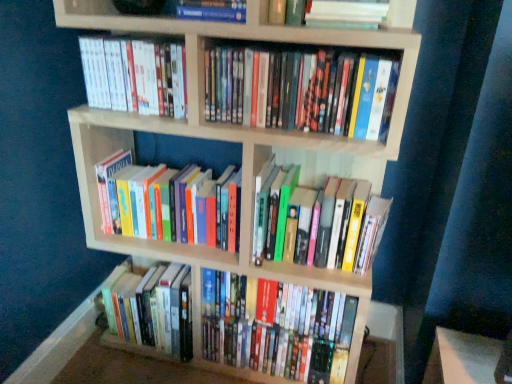
What is the approximate width of hardcover books at center, which appears as the 6th book when viewed from the top?

It is 9.18 inches.

The width and height of the screenshot is (512, 384). Describe the element at coordinates (338, 212) in the screenshot. I see `hardcover books at center, marked as the third book in a bottom-to-top arrangement` at that location.

The image size is (512, 384). What are the coordinates of `hardcover book at center, the eighth book from the top` in the screenshot? It's located at (279, 334).

The image size is (512, 384). In order to click on white matte book at upper center, the 7th book from the bottom in this screenshot , I will do `click(333, 14)`.

Can you confirm if hardcover books at center, which is counted as the 4th book, starting from the bottom, is thinner than hardcover book at center, which ranks as the first book in bottom-to-top order?

Yes, hardcover books at center, which is counted as the 4th book, starting from the bottom, is thinner than hardcover book at center, which ranks as the first book in bottom-to-top order.

Does hardcover books at center, acting as the 5th book starting from the top, appear on the left side of hardcover book at center, the eighth book from the top?

Indeed, hardcover books at center, acting as the 5th book starting from the top, is positioned on the left side of hardcover book at center, the eighth book from the top.

Is hardcover books at center, which is counted as the 4th book, starting from the bottom, positioned far away from hardcover book at center, which ranks as the first book in bottom-to-top order?

They are positioned close to each other.

From their relative heights in the image, would you say hardcover books at center, which is counted as the 4th book, starting from the bottom, is taller or shorter than hardcover book at center, the eighth book from the top?

Considering their sizes, hardcover books at center, which is counted as the 4th book, starting from the bottom, has less height than hardcover book at center, the eighth book from the top.

From the image's perspective, is wooden bookcase at center located above hardcover books at lower left, which is the second book from bottom to top?

Indeed, from the image's perspective, wooden bookcase at center is shown above hardcover books at lower left, which is the second book from bottom to top.

Which is closer to the camera, [273,140] or [144,332]?

Clearly, point [273,140] is closer to the camera than point [144,332].

How different are the orientations of wooden bookcase at center and hardcover books at lower left, which is the second book from bottom to top, in degrees?

They differ by 0.484 degrees in their facing directions.

Is wooden bookcase at center aimed at hardcover books at lower left, which is the second book from bottom to top?

Yes, wooden bookcase at center is turned towards hardcover books at lower left, which is the second book from bottom to top.

From the image's perspective, is hardcover book at center, the eighth book from the top, on top of white matte book at upper left, positioned as the 3th book in top-to-bottom order?

No, from the image's perspective, hardcover book at center, the eighth book from the top, is not over white matte book at upper left, positioned as the 3th book in top-to-bottom order.

Do you think hardcover book at center, the eighth book from the top, is within white matte book at upper left, positioned as the 3th book in top-to-bottom order, or outside of it?

hardcover book at center, the eighth book from the top, is outside white matte book at upper left, positioned as the 3th book in top-to-bottom order.

Between hardcover book at center, the eighth book from the top, and white matte book at upper left, the sixth book in the bottom-to-top sequence, which one has smaller size?

white matte book at upper left, the sixth book in the bottom-to-top sequence, is smaller.

From the image's perspective, count 5th books downward from the white matte book at upper left, the sixth book in the bottom-to-top sequence, and point to it. Please provide its 2D coordinates.

[(279, 334)]

Would you say white matte book at upper left, positioned as the 3th book in top-to-bottom order, is part of wooden bookcase at center's contents?

Yes, white matte book at upper left, positioned as the 3th book in top-to-bottom order, is a part of wooden bookcase at center.

Between point (372, 164) and point (124, 101), which one is positioned in front?

Positioned in front is point (124, 101).

From a real-world perspective, which object rests below the other?

wooden bookcase at center.

At what (x,y) coordinates should I click in order to perform the action: click on bookcase on the right of white matte book at upper left, positioned as the 3th book in top-to-bottom order. Please return your answer as a coordinate pair (x, y). The image size is (512, 384). Looking at the image, I should click on (241, 135).

From a real-world perspective, count 3rd books downward from the white matte book at upper left, positioned as the 3th book in top-to-bottom order, and point to it. Please provide its 2D coordinates.

[(148, 199)]

Between white matte book at upper left, the sixth book in the bottom-to-top sequence, and hardcover books at center, which is counted as the 4th book, starting from the bottom, which one has less height?

With less height is white matte book at upper left, the sixth book in the bottom-to-top sequence.

Is white matte book at upper left, positioned as the 3th book in top-to-bottom order, bigger than hardcover books at center, acting as the 5th book starting from the top?

No.

From the image's perspective, is white matte book at upper left, positioned as the 3th book in top-to-bottom order, above or below hardcover books at center, which is counted as the 4th book, starting from the bottom?

Clearly, from the image's perspective, white matte book at upper left, positioned as the 3th book in top-to-bottom order, is above hardcover books at center, which is counted as the 4th book, starting from the bottom.

Who is shorter, white matte book at upper center, the 7th book from the bottom, or hardcover books at center, marked as the third book in a bottom-to-top arrangement?

Standing shorter between the two is white matte book at upper center, the 7th book from the bottom.

Who is smaller, white matte book at upper center, the second book in the top-to-bottom sequence, or hardcover books at center, marked as the third book in a bottom-to-top arrangement?

With smaller size is white matte book at upper center, the second book in the top-to-bottom sequence.

Which is less distant, (341, 21) or (356, 203)?

Point (341, 21).

Are white matte book at upper left, positioned as the 3th book in top-to-bottom order, and hardcover book at upper center, the eighth book from the bottom, located far from each other?

No, there isn't a large distance between white matte book at upper left, positioned as the 3th book in top-to-bottom order, and hardcover book at upper center, the eighth book from the bottom.

How many degrees apart are the facing directions of white matte book at upper left, the sixth book in the bottom-to-top sequence, and hardcover book at upper center, the eighth book from the bottom?

The facing directions of white matte book at upper left, the sixth book in the bottom-to-top sequence, and hardcover book at upper center, the eighth book from the bottom, are 0.00477 degrees apart.

In terms of width, does white matte book at upper left, the sixth book in the bottom-to-top sequence, look wider or thinner when compared to hardcover book at upper center, placed as the first book when sorted from top to bottom?

white matte book at upper left, the sixth book in the bottom-to-top sequence, is thinner than hardcover book at upper center, placed as the first book when sorted from top to bottom.

Can you confirm if white matte book at upper left, the sixth book in the bottom-to-top sequence, is bigger than hardcover book at upper center, placed as the first book when sorted from top to bottom?

Correct, white matte book at upper left, the sixth book in the bottom-to-top sequence, is larger in size than hardcover book at upper center, placed as the first book when sorted from top to bottom.

Locate an element on the screen. The image size is (512, 384). book that is the 1st object above the hardcover book at center, the eighth book from the top (from a real-world perspective) is located at coordinates (148, 199).

The image size is (512, 384). Find the location of `bookcase located on the right of hardcover books at lower left, which ranks as the seventh book in top-to-bottom order`. bookcase located on the right of hardcover books at lower left, which ranks as the seventh book in top-to-bottom order is located at coordinates (241, 135).

Estimate the real-world distances between objects in this image. Which object is closer to white matte book at upper left, the sixth book in the bottom-to-top sequence, hardcover books at lower left, which ranks as the seventh book in top-to-bottom order, or hardcover books at center, which is counted as the 4th book, starting from the bottom?

Among the two, hardcover books at center, which is counted as the 4th book, starting from the bottom, is located nearer to white matte book at upper left, the sixth book in the bottom-to-top sequence.

Which object lies further to the anchor point hardcover books at lower left, which is the second book from bottom to top, white matte book at upper left, the sixth book in the bottom-to-top sequence, or white matte book at upper center, the second book in the top-to-bottom sequence?

The object further to hardcover books at lower left, which is the second book from bottom to top, is white matte book at upper center, the second book in the top-to-bottom sequence.

Based on their spatial positions, is hardcover book at upper center, placed as the first book when sorted from top to bottom, or hardcover books at center, marked as the third book in a bottom-to-top arrangement, further from multicolored hardcover books at upper center, which appears as the 5th book when ordered from the bottom?

hardcover books at center, marked as the third book in a bottom-to-top arrangement, is positioned further to the anchor multicolored hardcover books at upper center, which appears as the 5th book when ordered from the bottom.

Looking at the image, which one is located closer to wooden bookcase at center, hardcover books at center, which appears as the 6th book when viewed from the top, or white matte book at upper left, the sixth book in the bottom-to-top sequence?

hardcover books at center, which appears as the 6th book when viewed from the top, is positioned closer to the anchor wooden bookcase at center.

From the image, which object appears to be nearer to hardcover books at center, which appears as the 6th book when viewed from the top, hardcover books at lower left, which is the second book from bottom to top, or multicolored hardcover books at upper center, which appears as the 5th book when ordered from the bottom?

Based on the image, multicolored hardcover books at upper center, which appears as the 5th book when ordered from the bottom, appears to be nearer to hardcover books at center, which appears as the 6th book when viewed from the top.

Considering their positions, is hardcover books at lower left, which ranks as the seventh book in top-to-bottom order, positioned further to hardcover book at upper center, the eighth book from the bottom, than multicolored hardcover books at upper center, which ranks as the fourth book in top-to-bottom order?

hardcover books at lower left, which ranks as the seventh book in top-to-bottom order, is positioned further to the anchor hardcover book at upper center, the eighth book from the bottom.

Estimate the real-world distances between objects in this image. Which object is closer to multicolored hardcover books at upper center, which ranks as the fourth book in top-to-bottom order, hardcover books at center, marked as the third book in a bottom-to-top arrangement, or white matte book at upper center, the second book in the top-to-bottom sequence?

white matte book at upper center, the second book in the top-to-bottom sequence.

Which object lies nearer to the anchor point multicolored hardcover books at upper center, which appears as the 5th book when ordered from the bottom, hardcover book at center, the eighth book from the top, or wooden bookcase at center?

wooden bookcase at center is closer to multicolored hardcover books at upper center, which appears as the 5th book when ordered from the bottom.

Locate an element on the screen. bookcase between hardcover book at upper center, the eighth book from the bottom, and hardcover books at lower left, which ranks as the seventh book in top-to-bottom order, from top to bottom is located at coordinates (241, 135).

Identify the location of bookcase between white matte book at upper center, the 7th book from the bottom, and hardcover books at center, marked as the third book in a bottom-to-top arrangement, in the vertical direction. [x=241, y=135].

This screenshot has height=384, width=512. What are the coordinates of `bookcase between white matte book at upper left, positioned as the 3th book in top-to-bottom order, and white matte book at upper center, the 7th book from the bottom, in the horizontal direction` in the screenshot? It's located at (241, 135).

Identify the location of bookcase between hardcover book at upper center, placed as the first book when sorted from top to bottom, and hardcover books at center, marked as the third book in a bottom-to-top arrangement, in the up-down direction. (241, 135).